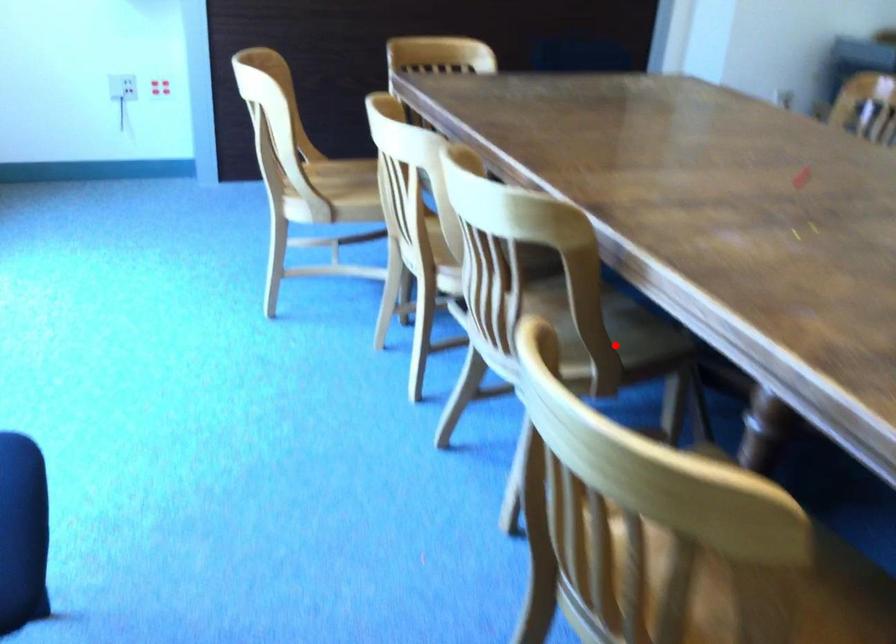
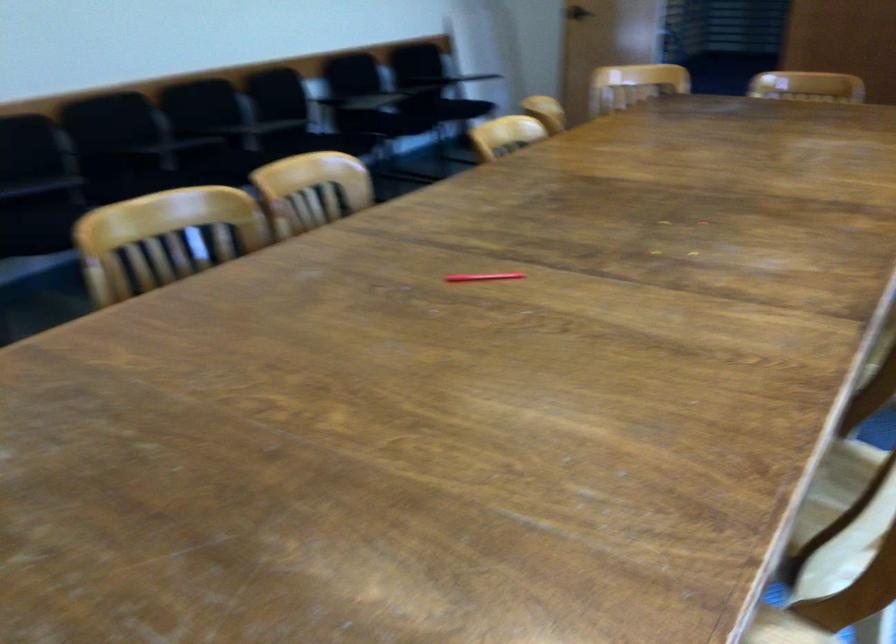
Question: I am providing you with two images of the same scene from different viewpoints. A red point is marked on the first image. Can you still see the location of the red point in image 2?

Choices:
 (A) Yes
 (B) No

Answer: (B)